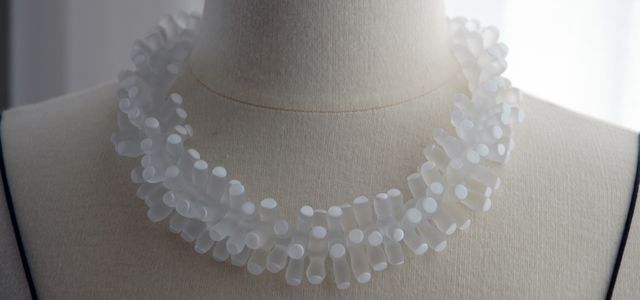
The width and height of the screenshot is (640, 300). I want to click on light, so click(610, 76).